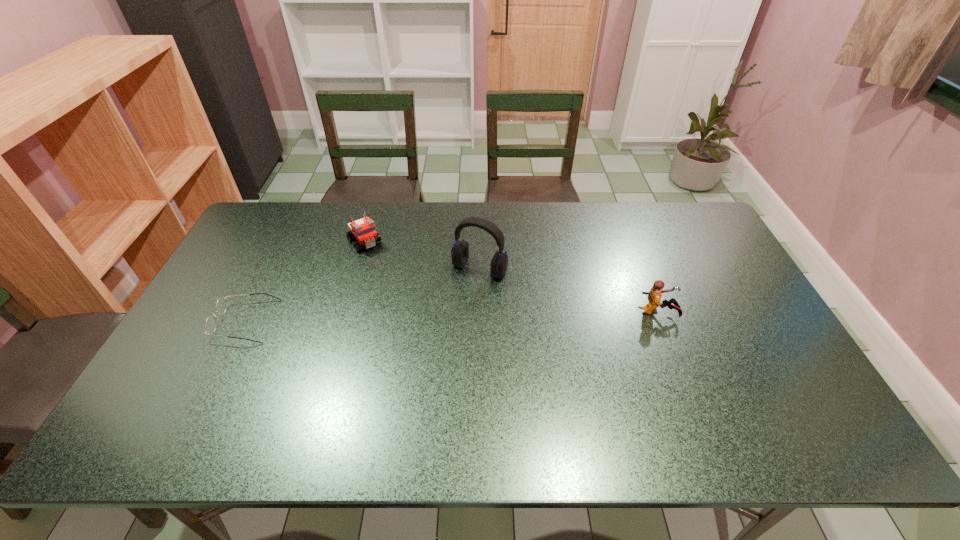
The height and width of the screenshot is (540, 960). I want to click on the shortest object, so click(x=221, y=305).

The height and width of the screenshot is (540, 960). Identify the location of the leftmost object. (221, 305).

I want to click on the nearer Lego, so click(654, 296).

At what (x,y) coordinates should I click in order to perform the action: click on the rightmost object. Please return your answer as a coordinate pair (x, y). This screenshot has width=960, height=540. Looking at the image, I should click on (654, 296).

This screenshot has width=960, height=540. What are the coordinates of `the farthest object` in the screenshot? It's located at (364, 229).

The height and width of the screenshot is (540, 960). I want to click on the left Lego, so click(x=364, y=229).

Image resolution: width=960 pixels, height=540 pixels. I want to click on the third nearest object, so click(460, 251).

This screenshot has width=960, height=540. Find the location of `the tallest object`. the tallest object is located at coordinates (460, 251).

At what (x,y) coordinates should I click in order to perform the action: click on blank space located holding a crossbow in the hands of the right Lego. Please return your answer as a coordinate pair (x, y). Looking at the image, I should click on (701, 312).

Identify the location of free location located on the front-facing side of the left Lego. This screenshot has height=540, width=960. (392, 278).